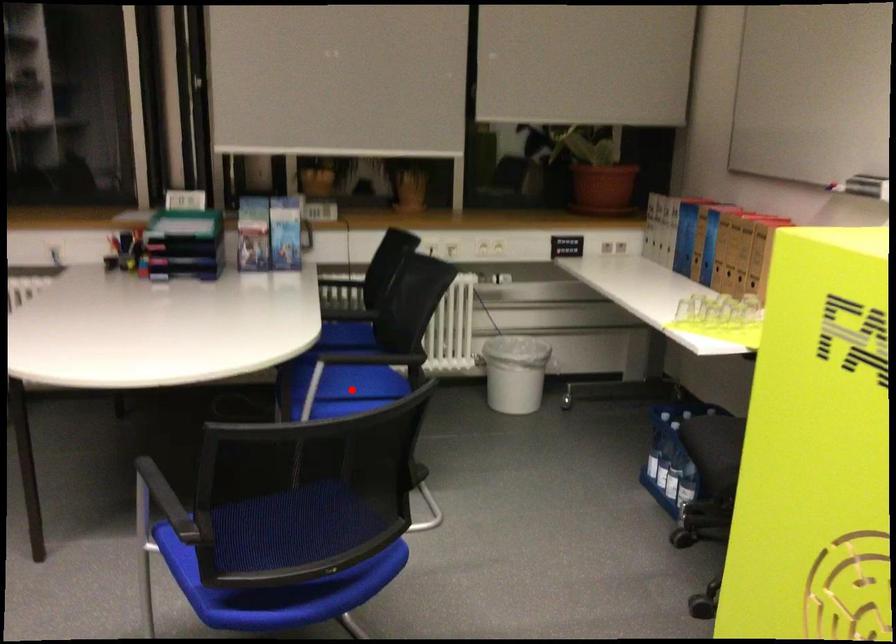
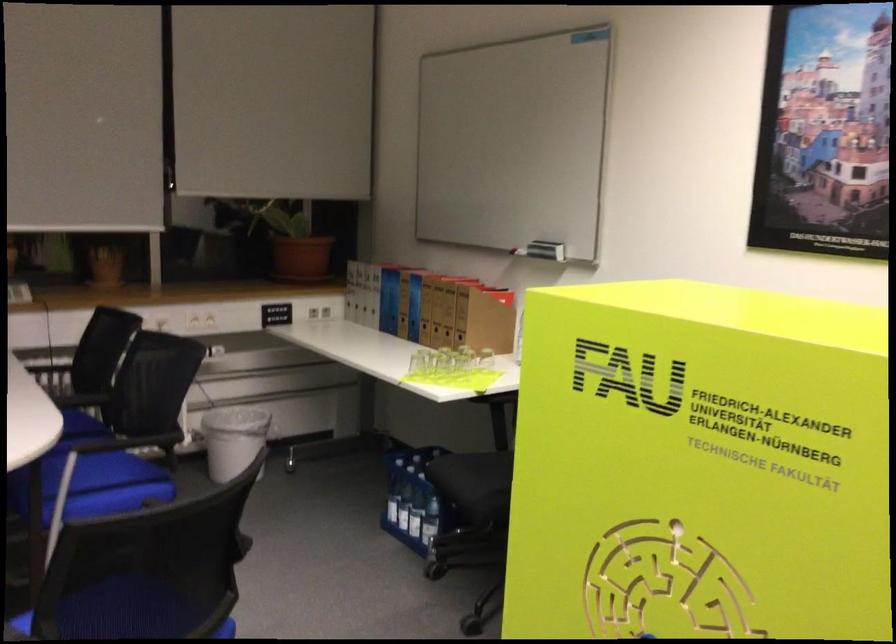
In the second image, find the point that corresponds to the highlighted location in the first image.

(95, 485)